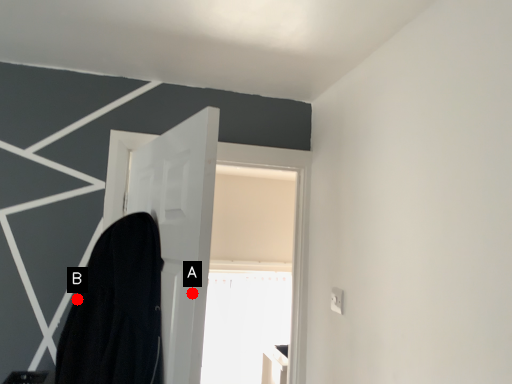
Question: Two points are circled on the image, labeled by A and B beside each circle. Which point is closer to the camera?

Choices:
 (A) A is closer
 (B) B is closer

Answer: (A)